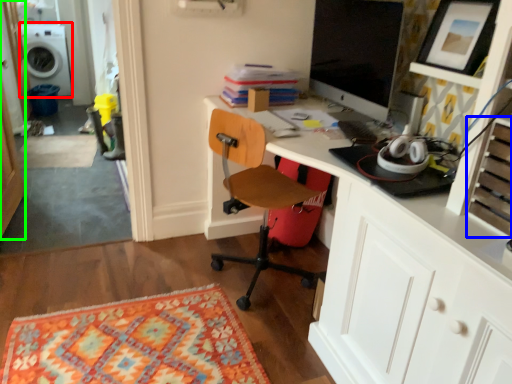
Question: Which is farther away from washing machine (highlighted by a red box)? drawer (highlighted by a blue box) or glass door (highlighted by a green box)?

Choices:
 (A) drawer
 (B) glass door

Answer: (A)